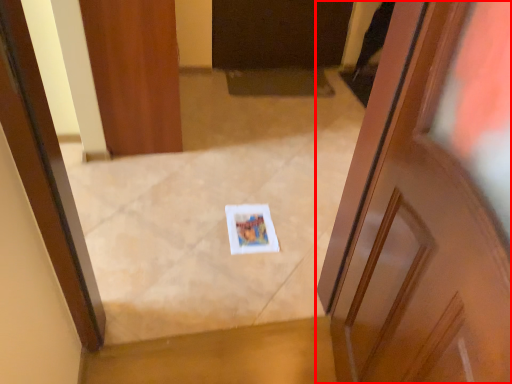
Question: Considering the relative positions of door (annotated by the red box) and door in the image provided, where is door (annotated by the red box) located with respect to the staircase?

Choices:
 (A) right
 (B) left

Answer: (A)